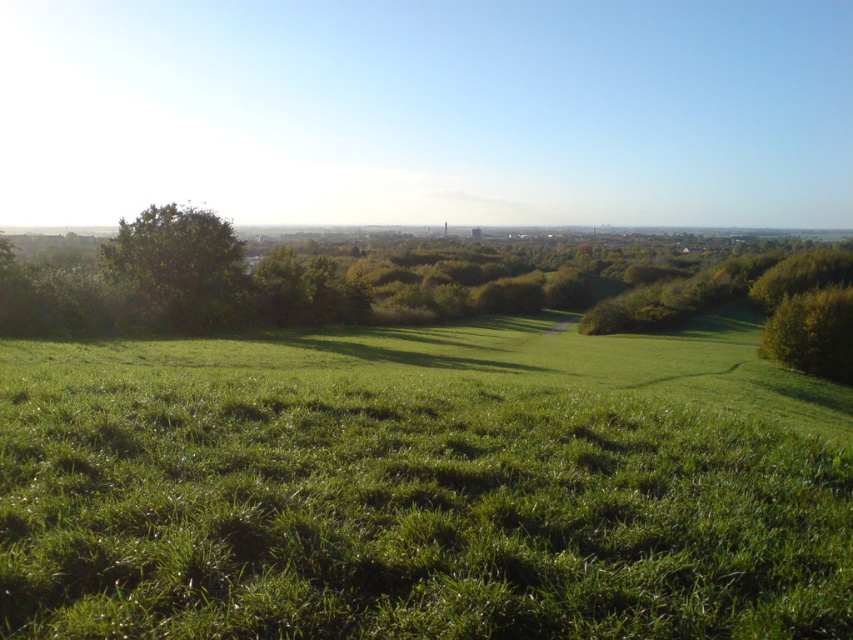
Question: Considering the real-world distances, which object is farthest from the green grassy field at center?

Choices:
 (A) green leafy tree at right
 (B) green leafy tree at left

Answer: (A)

Question: Which of the following is the closest to the observer?

Choices:
 (A) (196, 252)
 (B) (830, 312)

Answer: (A)

Question: Where is green grassy field at center located in relation to green leafy tree at left in the image?

Choices:
 (A) right
 (B) left

Answer: (A)

Question: Which of these objects is positioned farthest from the green leafy tree at right?

Choices:
 (A) green grassy field at center
 (B) green leafy tree at left

Answer: (B)

Question: In this image, where is green grassy field at center located relative to green leafy tree at right?

Choices:
 (A) below
 (B) above

Answer: (A)

Question: Is green grassy field at center below green leafy tree at right?

Choices:
 (A) yes
 (B) no

Answer: (A)